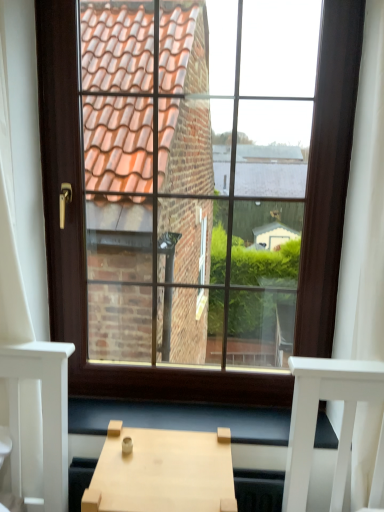
Locate an element on the screen. vacant space situated above wooden at lower center (from a real-world perspective) is located at coordinates (186, 413).